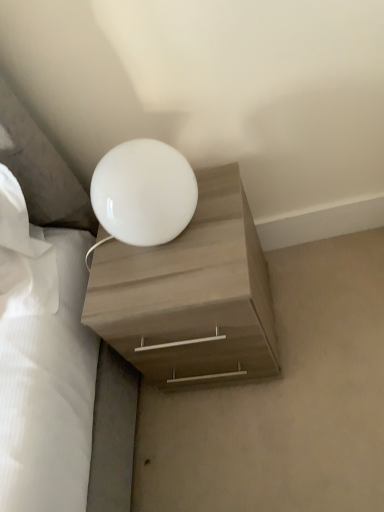
The image size is (384, 512). What are the coordinates of `white glossy sphere at upper center` in the screenshot? It's located at (143, 193).

The height and width of the screenshot is (512, 384). I want to click on matte wood nightstand at center, so click(x=190, y=294).

Image resolution: width=384 pixels, height=512 pixels. Find the location of `nightstand on the left of white glossy lamp at upper center`. nightstand on the left of white glossy lamp at upper center is located at coordinates (190, 294).

Would you say white glossy lamp at upper center is a long distance from matte wood nightstand at center?

No, white glossy lamp at upper center is not far from matte wood nightstand at center.

Is white glossy lamp at upper center positioned behind matte wood nightstand at center?

Yes, it is.

From the picture: Is white glossy sphere at upper center positioned beyond the bounds of matte wood nightstand at center?

Absolutely, white glossy sphere at upper center is external to matte wood nightstand at center.

Is white glossy sphere at upper center oriented away from matte wood nightstand at center?

white glossy sphere at upper center is not turned away from matte wood nightstand at center.

Based on their sizes in the image, would you say white glossy sphere at upper center is bigger or smaller than matte wood nightstand at center?

Clearly, white glossy sphere at upper center is smaller in size than matte wood nightstand at center.

Locate an element on the screen. The height and width of the screenshot is (512, 384). lamp above the matte wood nightstand at center (from a real-world perspective) is located at coordinates pos(143,193).

Is white glossy sphere at upper center not within white glossy lamp at upper center?

Absolutely, white glossy sphere at upper center is external to white glossy lamp at upper center.

From a real-world perspective, is white glossy sphere at upper center below white glossy lamp at upper center?

No.

Does white glossy sphere at upper center appear on the right side of white glossy lamp at upper center?

No, white glossy sphere at upper center is not to the right of white glossy lamp at upper center.

Considering the relative sizes of white glossy sphere at upper center and white glossy lamp at upper center in the image provided, is white glossy sphere at upper center thinner than white glossy lamp at upper center?

Yes.

From a real-world perspective, between white glossy lamp at upper center and white glossy sphere at upper center, who is vertically higher?

white glossy sphere at upper center.

Which is correct: white glossy lamp at upper center is inside white glossy sphere at upper center, or outside of it?

white glossy lamp at upper center is located beyond the bounds of white glossy sphere at upper center.

Does white glossy lamp at upper center lie behind white glossy sphere at upper center?

Yes, white glossy lamp at upper center is behind white glossy sphere at upper center.

Who is shorter, white glossy lamp at upper center or white glossy sphere at upper center?

With less height is white glossy lamp at upper center.

Who is bigger, matte wood nightstand at center or white glossy sphere at upper center?

matte wood nightstand at center.

From the image's perspective, which is above, matte wood nightstand at center or white glossy sphere at upper center?

white glossy sphere at upper center appears higher in the image.

Is point (220, 223) farther from viewer compared to point (129, 240)?

That is True.

At what (x,y) coordinates should I click in order to perform the action: click on nightstand behind the white glossy sphere at upper center. Please return your answer as a coordinate pair (x, y). Looking at the image, I should click on (190, 294).

Considering the relative sizes of matte wood nightstand at center and white glossy lamp at upper center in the image provided, is matte wood nightstand at center shorter than white glossy lamp at upper center?

No, matte wood nightstand at center is not shorter than white glossy lamp at upper center.

Considering the relative positions of matte wood nightstand at center and white glossy lamp at upper center in the image provided, is matte wood nightstand at center to the left or to the right of white glossy lamp at upper center?

matte wood nightstand at center is to the left of white glossy lamp at upper center.

Between matte wood nightstand at center and white glossy lamp at upper center, which one is positioned behind?

white glossy lamp at upper center.

Identify the location of concrete lying on the right of matte wood nightstand at center. The image size is (384, 512). (283, 401).

Find the location of a particular element. The image size is (384, 512). lamp above the matte wood nightstand at center (from a real-world perspective) is located at coordinates pyautogui.click(x=143, y=193).

Consider the image. When comparing their distances from matte wood nightstand at center, does white glossy lamp at upper center or white glossy sphere at upper center seem further?

The object further to matte wood nightstand at center is white glossy lamp at upper center.

Looking at the image, which one is located closer to white glossy sphere at upper center, matte wood nightstand at center or white glossy lamp at upper center?

The object closer to white glossy sphere at upper center is matte wood nightstand at center.

Looking at the image, which one is located closer to white glossy lamp at upper center, white glossy sphere at upper center or matte wood nightstand at center?

matte wood nightstand at center is positioned closer to the anchor white glossy lamp at upper center.

When comparing their distances from white glossy lamp at upper center, does matte wood nightstand at center or white glossy sphere at upper center seem further?

white glossy sphere at upper center lies further to white glossy lamp at upper center than the other object.

Estimate the real-world distances between objects in this image. Which object is further from white glossy sphere at upper center, white glossy lamp at upper center or matte wood nightstand at center?

white glossy lamp at upper center is further to white glossy sphere at upper center.

From the image, which object appears to be farther from matte wood nightstand at center, white glossy sphere at upper center or white glossy lamp at upper center?

white glossy lamp at upper center is positioned further to the anchor matte wood nightstand at center.

Where is `nightstand between white glossy sphere at upper center and white glossy lamp at upper center vertically`? The image size is (384, 512). nightstand between white glossy sphere at upper center and white glossy lamp at upper center vertically is located at coordinates (190, 294).